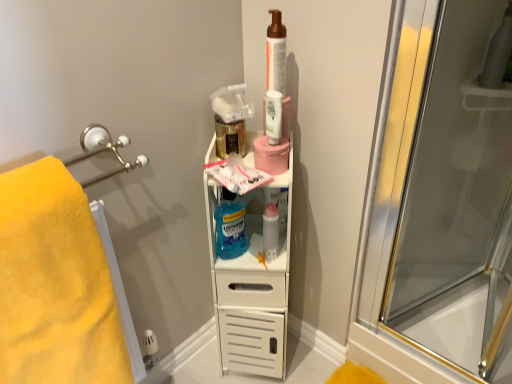
In order to face blue translucent liquid mouthwash at center, should I rotate leftwards or rightwards?

Rotate your view left by about 3.296°.

The image size is (512, 384). Describe the element at coordinates (250, 294) in the screenshot. I see `white plastic shelf at center` at that location.

The image size is (512, 384). Describe the element at coordinates (270, 232) in the screenshot. I see `translucent plastic mouthwash at center, positioned as the second mouthwash in front-to-back order` at that location.

Locate an element on the screen. This screenshot has width=512, height=384. blue translucent liquid mouthwash at center is located at coordinates [x=230, y=227].

Does point (445, 266) appear closer or farther from the camera than point (270, 104)?

Point (445, 266) is positioned farther from the camera compared to point (270, 104).

Can translucent plastic mouthwash at upper center, the first mouthwash viewed from the top, be found inside transparent glass screen door at right?

No.

Can you see transparent glass screen door at right touching translucent plastic mouthwash at upper center, the first mouthwash when ordered from front to back?

No.

Who is bigger, matte brown pump bottle at upper center or blue translucent liquid mouthwash at center?

Bigger between the two is blue translucent liquid mouthwash at center.

From a real-world perspective, between matte brown pump bottle at upper center and blue translucent liquid mouthwash at center, who is vertically higher?

Answer: In real-world perspective, matte brown pump bottle at upper center is above.

Is matte brown pump bottle at upper center to the right of blue translucent liquid mouthwash at center from the viewer's perspective?

Indeed, matte brown pump bottle at upper center is positioned on the right side of blue translucent liquid mouthwash at center.

How distant is blue translucent liquid mouthwash at center from white plastic shelf at center?

A distance of 6.40 inches exists between blue translucent liquid mouthwash at center and white plastic shelf at center.

Looking at their sizes, would you say blue translucent liquid mouthwash at center is wider or thinner than white plastic shelf at center?

Considering their sizes, blue translucent liquid mouthwash at center looks slimmer than white plastic shelf at center.

Is blue translucent liquid mouthwash at center positioned in front of white plastic shelf at center?

That is False.

Which object is positioned more to the left, blue translucent liquid mouthwash at center or white plastic shelf at center?

From the viewer's perspective, blue translucent liquid mouthwash at center appears more on the left side.

Considering the positions of point (66, 322) and point (227, 244), is point (66, 322) closer or farther from the camera than point (227, 244)?

Clearly, point (66, 322) is closer to the camera than point (227, 244).

From a real-world perspective, is yellow soft towel at left beneath blue translucent liquid mouthwash at center?

Correct, in the physical world, yellow soft towel at left is lower than blue translucent liquid mouthwash at center.

Does yellow soft towel at left have a lesser width compared to blue translucent liquid mouthwash at center?

In fact, yellow soft towel at left might be wider than blue translucent liquid mouthwash at center.

Is translucent plastic mouthwash at upper center, the first mouthwash when ordered from front to back, at the right side of matte brown pump bottle at upper center?

No, translucent plastic mouthwash at upper center, the first mouthwash when ordered from front to back, is not to the right of matte brown pump bottle at upper center.

Does translucent plastic mouthwash at upper center, which appears as the second mouthwash when ordered from the bottom, have a smaller size compared to matte brown pump bottle at upper center?

Correct, translucent plastic mouthwash at upper center, which appears as the second mouthwash when ordered from the bottom, occupies less space than matte brown pump bottle at upper center.

From a real-world perspective, is translucent plastic mouthwash at upper center, the first mouthwash viewed from the top, physically located above or below matte brown pump bottle at upper center?

Clearly, from a real-world perspective, translucent plastic mouthwash at upper center, the first mouthwash viewed from the top, is below matte brown pump bottle at upper center.

Can you confirm if translucent plastic mouthwash at upper center, the first mouthwash viewed from the top, is thinner than matte brown pump bottle at upper center?

No.

This screenshot has width=512, height=384. What are the coordinates of `the 2nd mouthwash counting from the left side of the transparent glass screen door at right` in the screenshot? It's located at (270, 232).

Relative to transparent glass screen door at right, is translucent plastic mouthwash at center, arranged as the 2th mouthwash when viewed from the top, in front or behind?

translucent plastic mouthwash at center, arranged as the 2th mouthwash when viewed from the top, is behind transparent glass screen door at right.

Is translucent plastic mouthwash at center, arranged as the 2th mouthwash when viewed from the top, not close to transparent glass screen door at right?

translucent plastic mouthwash at center, arranged as the 2th mouthwash when viewed from the top, is actually quite close to transparent glass screen door at right.

What's the angular difference between blue translucent liquid mouthwash at center and translucent plastic mouthwash at upper center, the first mouthwash when ordered from front to back,'s facing directions?

There is a 44.8-degree angle between the facing directions of blue translucent liquid mouthwash at center and translucent plastic mouthwash at upper center, the first mouthwash when ordered from front to back.

Consider the image. Considering the sizes of blue translucent liquid mouthwash at center and translucent plastic mouthwash at upper center, the first mouthwash viewed from the top, in the image, is blue translucent liquid mouthwash at center taller or shorter than translucent plastic mouthwash at upper center, the first mouthwash viewed from the top,?

Considering their sizes, blue translucent liquid mouthwash at center has more height than translucent plastic mouthwash at upper center, the first mouthwash viewed from the top.

Is blue translucent liquid mouthwash at center inside or outside of translucent plastic mouthwash at upper center, the first mouthwash when ordered from front to back?

blue translucent liquid mouthwash at center is not inside translucent plastic mouthwash at upper center, the first mouthwash when ordered from front to back, it's outside.

In the image, is blue translucent liquid mouthwash at center positioned in front of or behind translucent plastic mouthwash at upper center, the first mouthwash when ordered from front to back?

blue translucent liquid mouthwash at center is positioned farther from the viewer than translucent plastic mouthwash at upper center, the first mouthwash when ordered from front to back.

Locate an element on the screen. This screenshot has width=512, height=384. screen door below the translucent plastic mouthwash at upper center, the first mouthwash viewed from the top (from the image's perspective) is located at coordinates (458, 194).

The width and height of the screenshot is (512, 384). I want to click on cleaning product directly beneath the matte brown pump bottle at upper center (from a real-world perspective), so click(x=230, y=227).

Considering their positions, is yellow soft towel at left positioned further to translucent plastic mouthwash at upper center, positioned as the 2th mouthwash in back-to-front order, than transparent glass screen door at right?

transparent glass screen door at right.

Which object lies further to the anchor point translucent plastic mouthwash at center, arranged as the 2th mouthwash when viewed from the top, transparent glass screen door at right or matte brown pump bottle at upper center?

transparent glass screen door at right lies further to translucent plastic mouthwash at center, arranged as the 2th mouthwash when viewed from the top, than the other object.

From the picture: Which object lies further to the anchor point yellow soft towel at left, white plastic shelf at center or blue translucent liquid mouthwash at center?

Based on the image, blue translucent liquid mouthwash at center appears to be further to yellow soft towel at left.

Considering their positions, is white plastic shelf at center positioned closer to matte brown pump bottle at upper center than translucent plastic mouthwash at upper center, positioned as the 2th mouthwash in back-to-front order?

Among the two, translucent plastic mouthwash at upper center, positioned as the 2th mouthwash in back-to-front order, is located nearer to matte brown pump bottle at upper center.

Based on their spatial positions, is blue translucent liquid mouthwash at center or transparent glass screen door at right closer to yellow soft towel at left?

blue translucent liquid mouthwash at center is positioned closer to the anchor yellow soft towel at left.

Looking at the image, which one is located further to translucent plastic mouthwash at upper center, positioned as the 2th mouthwash in back-to-front order, translucent plastic mouthwash at center, positioned as the second mouthwash in front-to-back order, or transparent glass screen door at right?

The object further to translucent plastic mouthwash at upper center, positioned as the 2th mouthwash in back-to-front order, is transparent glass screen door at right.

Which object lies nearer to the anchor point white plastic shelf at center, translucent plastic mouthwash at upper center, positioned as the 2th mouthwash in back-to-front order, or yellow soft towel at left?

yellow soft towel at left.

Based on their spatial positions, is white plastic shelf at center or translucent plastic mouthwash at center, arranged as the 2th mouthwash when viewed from the top, closer to yellow soft towel at left?

white plastic shelf at center is closer to yellow soft towel at left.

Identify the location of shelf situated between yellow soft towel at left and transparent glass screen door at right from left to right. (x=250, y=294).

Where is `cleaning product between translucent plastic mouthwash at upper center, positioned as the 2th mouthwash in back-to-front order, and translucent plastic mouthwash at center, arranged as the 2th mouthwash when viewed from the top, vertically`? The image size is (512, 384). cleaning product between translucent plastic mouthwash at upper center, positioned as the 2th mouthwash in back-to-front order, and translucent plastic mouthwash at center, arranged as the 2th mouthwash when viewed from the top, vertically is located at coordinates (230, 227).

At what (x,y) coordinates should I click in order to perform the action: click on toiletry situated between white plastic shelf at center and transparent glass screen door at right from left to right. Please return your answer as a coordinate pair (x, y). Looking at the image, I should click on (276, 54).

This screenshot has width=512, height=384. In order to click on cleaning product between matte brown pump bottle at upper center and white plastic shelf at center in the vertical direction in this screenshot , I will do coord(230,227).